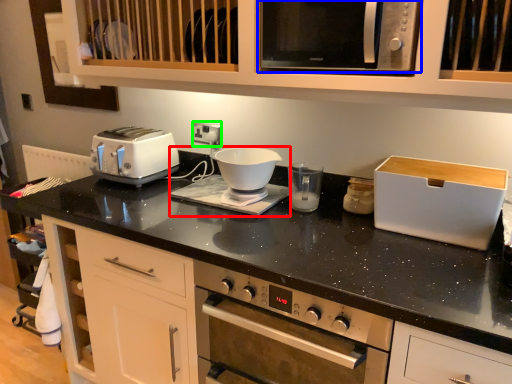
Question: Which object is positioned closest to coffee machine (highlighted by a red box)? Select from microwave oven (highlighted by a blue box) and electric outlet (highlighted by a green box).

Choices:
 (A) microwave oven
 (B) electric outlet

Answer: (B)